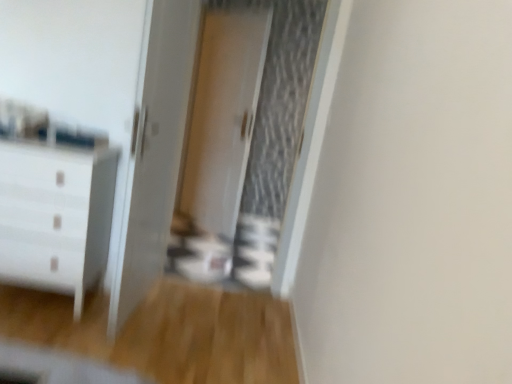
Question: Is white glossy chest of drawers at left bigger than white glossy door at center, the 2th screen door viewed from the front?

Choices:
 (A) no
 (B) yes

Answer: (B)

Question: Is white glossy chest of drawers at left to the left of white glossy door at center, the 2th screen door viewed from the front, from the viewer's perspective?

Choices:
 (A) no
 (B) yes

Answer: (B)

Question: From the image's perspective, is white glossy chest of drawers at left above white glossy door at center, the 2th screen door viewed from the front?

Choices:
 (A) no
 (B) yes

Answer: (A)

Question: Is the surface of white glossy chest of drawers at left in direct contact with white glossy door at center, the first screen door positioned from the back?

Choices:
 (A) no
 (B) yes

Answer: (A)

Question: Would you say white glossy chest of drawers at left contains white glossy door at center, the first screen door positioned from the back?

Choices:
 (A) no
 (B) yes

Answer: (A)

Question: Considering the positions of point (220, 173) and point (202, 122), is point (220, 173) closer or farther from the camera than point (202, 122)?

Choices:
 (A) farther
 (B) closer

Answer: (B)

Question: Considering the positions of white glossy door at center, the first screen door positioned from the back, and white glossy screen door at center, the second screen door when ordered from back to front, in the image, is white glossy door at center, the first screen door positioned from the back, bigger or smaller than white glossy screen door at center, the second screen door when ordered from back to front,?

Choices:
 (A) big
 (B) small

Answer: (B)

Question: In the image, is white glossy door at center, the 2th screen door viewed from the front, on the left side or the right side of white glossy screen door at center, the first screen door in the front-to-back sequence?

Choices:
 (A) right
 (B) left

Answer: (B)

Question: From a real-world perspective, is white glossy door at center, the 2th screen door viewed from the front, physically located above or below white glossy screen door at center, the second screen door when ordered from back to front?

Choices:
 (A) below
 (B) above

Answer: (B)

Question: Looking at the image, does white glossy screen door at center, the first screen door in the front-to-back sequence, seem bigger or smaller compared to white glossy chest of drawers at left?

Choices:
 (A) small
 (B) big

Answer: (B)

Question: Choose the correct answer: Is white glossy screen door at center, the second screen door when ordered from back to front, inside white glossy chest of drawers at left or outside it?

Choices:
 (A) outside
 (B) inside

Answer: (A)

Question: In the image, is white glossy screen door at center, the second screen door when ordered from back to front, positioned in front of or behind white glossy chest of drawers at left?

Choices:
 (A) behind
 (B) front

Answer: (A)

Question: Does point (196, 200) appear closer or farther from the camera than point (78, 278)?

Choices:
 (A) farther
 (B) closer

Answer: (A)

Question: In terms of height, does white glossy door at center look taller or shorter compared to white glossy chest of drawers at left?

Choices:
 (A) tall
 (B) short

Answer: (A)

Question: From a real-world perspective, relative to white glossy chest of drawers at left, is white glossy door at center vertically above or below?

Choices:
 (A) below
 (B) above

Answer: (B)